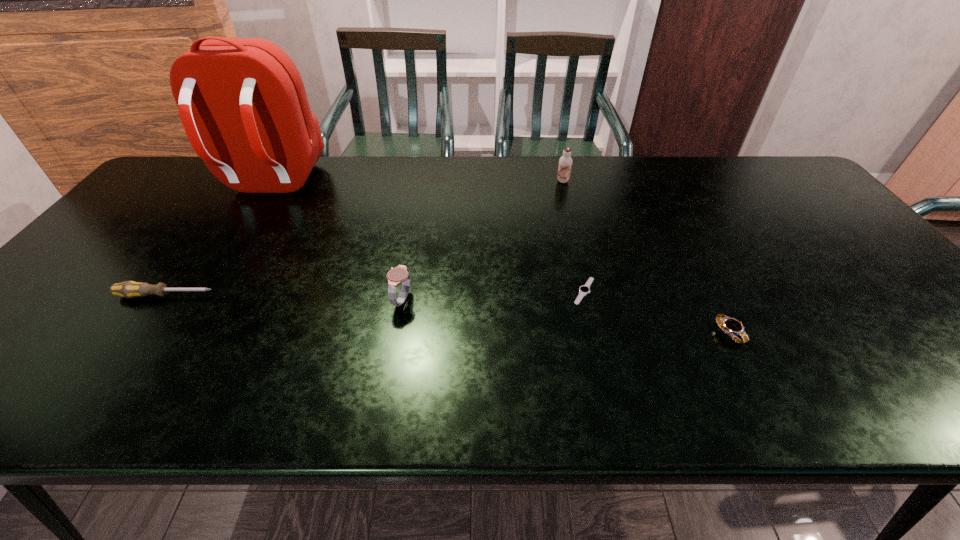
This screenshot has width=960, height=540. Identify the location of blank area in the image that satisfies the following two spatial constraints: 1. on the front side of the chocolate milk; 2. at the tip of the fourth tallest object. (591, 295).

Locate an element on the screen. free location that satisfies the following two spatial constraints: 1. on the strap side of the backpack; 2. on the right side of the rightmost watch is located at coordinates (177, 333).

I want to click on vacant space that satisfies the following two spatial constraints: 1. at the tip of the fifth tallest object; 2. on the left side of the third shortest object, so click(139, 333).

At what (x,y) coordinates should I click in order to perform the action: click on vacant area in the image that satisfies the following two spatial constraints: 1. on the front side of the chocolate milk; 2. at the tip of the fourth tallest object. Please return your answer as a coordinate pair (x, y). Looking at the image, I should click on (591, 295).